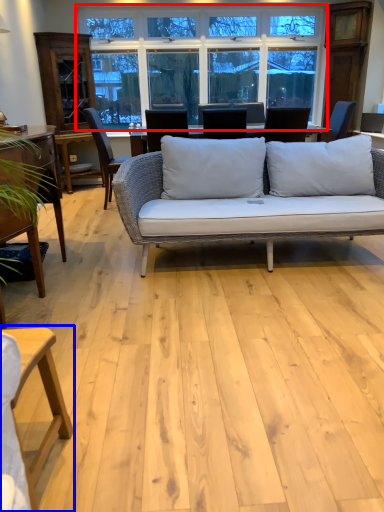
Question: Which of the following is the closest to the observer, window (highlighted by a red box) or table (highlighted by a blue box)?

Choices:
 (A) window
 (B) table

Answer: (B)